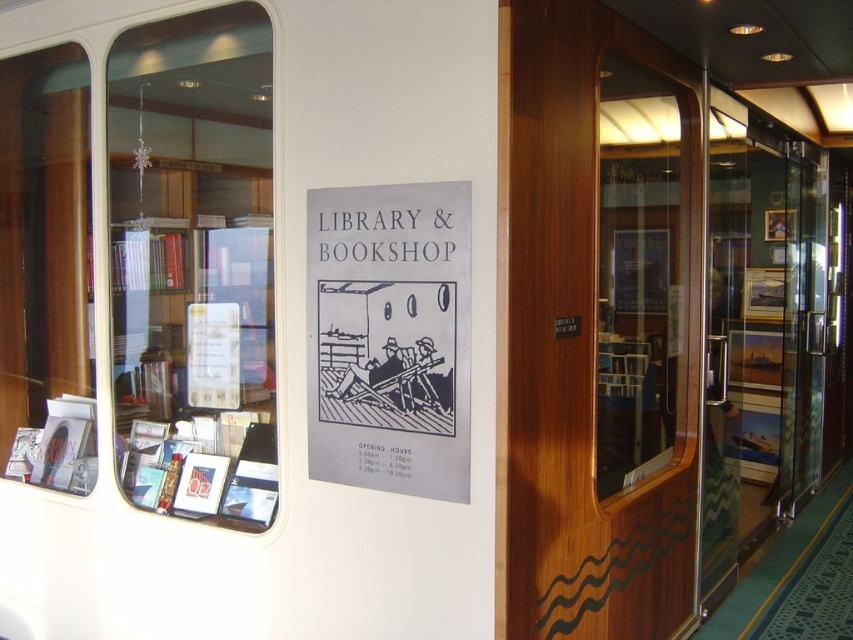
Between matte plastic book at lower left and white paper sign at center, which one is positioned higher?

white paper sign at center is higher up.

Is point (212, 483) closer to viewer compared to point (381, 244)?

That is False.

Is point (247, 483) positioned in front of point (358, 252)?

No.

Identify the location of matte plastic book at lower left. (206, 467).

Does transparent glass door at center appear on the right side of white paper sign at center?

Correct, you'll find transparent glass door at center to the right of white paper sign at center.

Between transparent glass door at center and white paper sign at center, which one has more height?

With more height is transparent glass door at center.

Which is in front, point (618, 266) or point (358, 250)?

Point (358, 250)

Image resolution: width=853 pixels, height=640 pixels. What are the coordinates of `transparent glass door at center` in the screenshot? It's located at (639, 272).

Can you confirm if gray paper poster at center is smaller than white paper sign at center?

No.

Can you confirm if gray paper poster at center is shorter than white paper sign at center?

Incorrect, gray paper poster at center's height does not fall short of white paper sign at center's.

Is point (428, 348) positioned in front of point (328, 225)?

Yes.

Where is `gray paper poster at center`? gray paper poster at center is located at coordinates click(x=390, y=332).